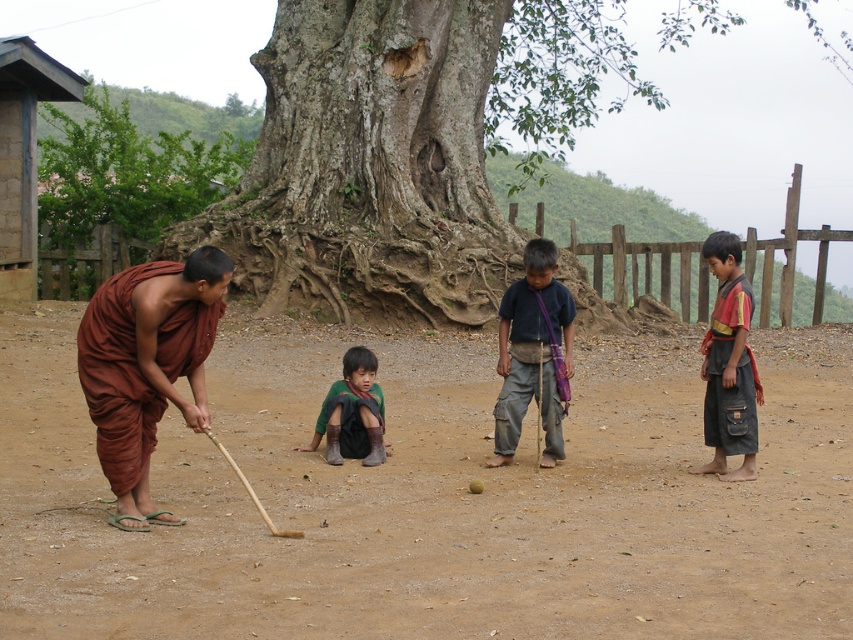
Which is in front, point (308, 573) or point (352, 355)?

Positioned in front is point (308, 573).

Does brown dirt field at center appear on the right side of dark green fabric at center?

Incorrect, brown dirt field at center is not on the right side of dark green fabric at center.

This screenshot has height=640, width=853. In order to click on brown dirt field at center in this screenshot , I will do `click(431, 497)`.

Who is taller, brown cloth monk at center or dark green fabric at center?

With more height is brown cloth monk at center.

Who is positioned more to the right, brown cloth monk at center or dark green fabric at center?

Positioned to the right is dark green fabric at center.

This screenshot has height=640, width=853. Identify the location of brown cloth monk at center. (148, 365).

Between green leafy tree at upper left and reddish-brown fabric pants at right, which one is positioned lower?

reddish-brown fabric pants at right is lower down.

Can you confirm if green leafy tree at upper left is shorter than reddish-brown fabric pants at right?

No.

Image resolution: width=853 pixels, height=640 pixels. I want to click on green leafy tree at upper left, so click(x=125, y=172).